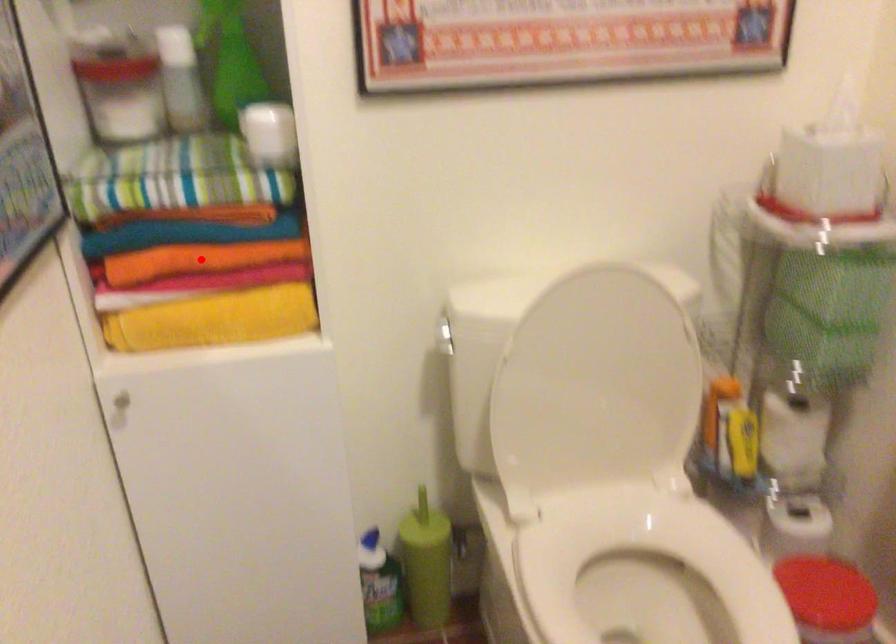
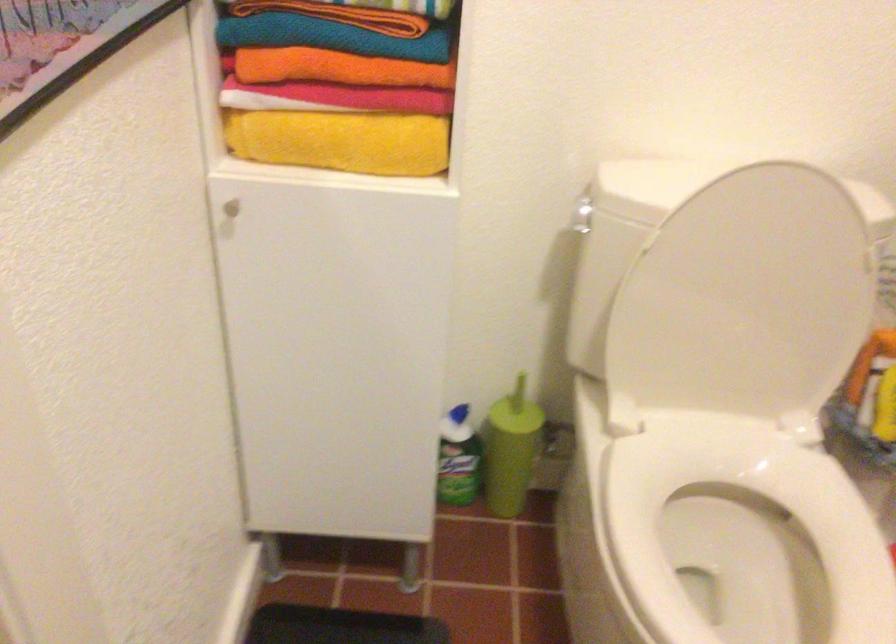
In the second image, find the point that corresponds to the highlighted location in the first image.

(339, 68)